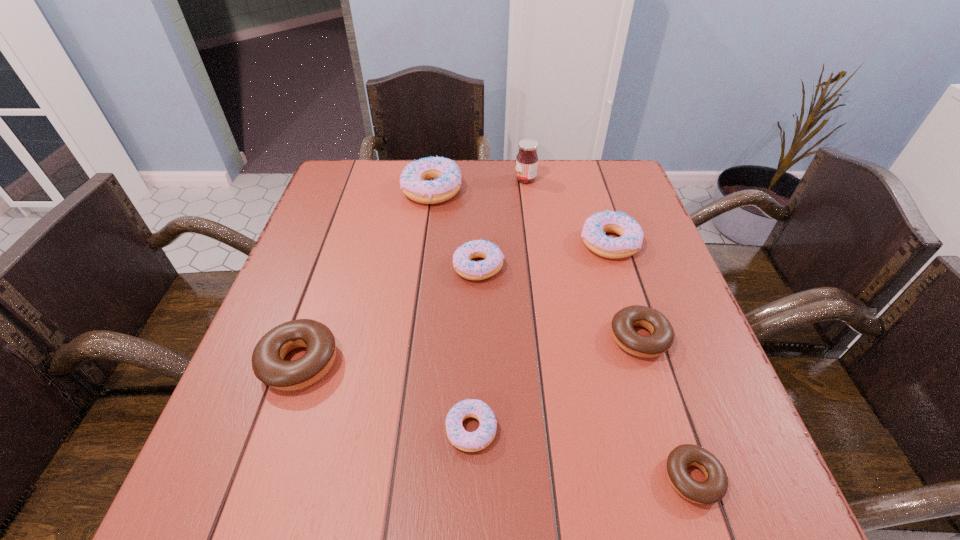
Image resolution: width=960 pixels, height=540 pixels. Identify the location of jam. [527, 159].

The width and height of the screenshot is (960, 540). I want to click on the fifth object from left to right, so click(527, 159).

The height and width of the screenshot is (540, 960). Find the location of `the second tallest object`. the second tallest object is located at coordinates (445, 173).

Find the location of `the farthest doughnut`. the farthest doughnut is located at coordinates (445, 173).

Where is `the second biggest purple doughnut`? the second biggest purple doughnut is located at coordinates (595, 226).

Where is `the leftmost brown doughnut`? The width and height of the screenshot is (960, 540). the leftmost brown doughnut is located at coordinates (268, 364).

The height and width of the screenshot is (540, 960). In order to click on the leftmost object in this screenshot , I will do `click(268, 364)`.

Where is `the third biggest purple doughnut`? This screenshot has height=540, width=960. the third biggest purple doughnut is located at coordinates (471, 270).

Where is `the second biggest brown doughnut`? the second biggest brown doughnut is located at coordinates (661, 338).

Where is `the smallest purple doughnut`? This screenshot has width=960, height=540. the smallest purple doughnut is located at coordinates (466, 441).